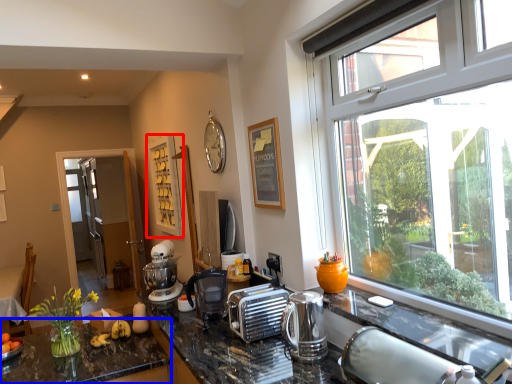
Question: Which object is further to the camera taking this photo, shelf (highlighted by a red box) or countertop (highlighted by a blue box)?

Choices:
 (A) shelf
 (B) countertop

Answer: (A)